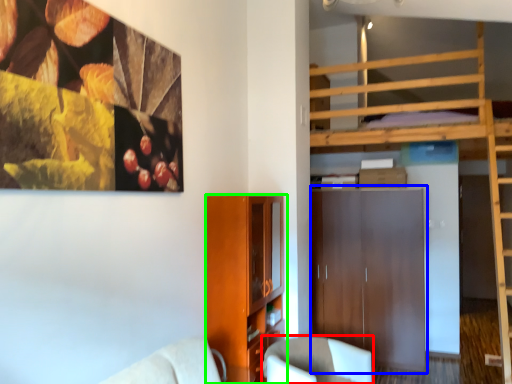
Question: Which object is the farthest from chair (highlighted by a red box)? Choose among these: dresser (highlighted by a blue box) or cabinetry (highlighted by a green box).

Choices:
 (A) dresser
 (B) cabinetry

Answer: (A)